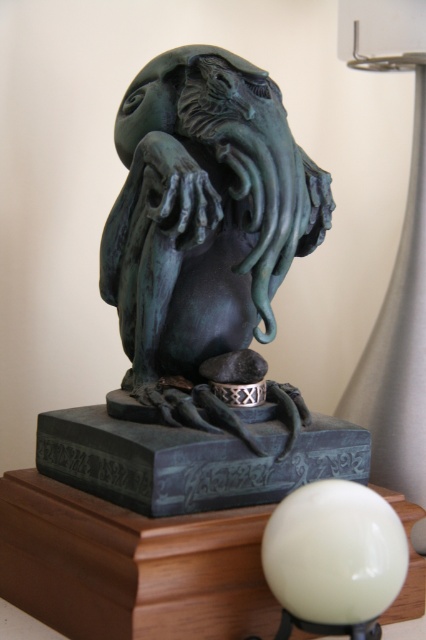
Which is more to the right, wooden table at lower left or white glossy sphere at lower center?

white glossy sphere at lower center

The width and height of the screenshot is (426, 640). In order to click on wooden table at lower left in this screenshot , I will do `click(129, 564)`.

Between green patina sculpture at center and white glossy sphere at lower center, which one is positioned lower?

Result: Positioned lower is white glossy sphere at lower center.

Can you confirm if green patina sculpture at center is thinner than white glossy sphere at lower center?

In fact, green patina sculpture at center might be wider than white glossy sphere at lower center.

Does point (143, 292) lie in front of point (331, 522)?

No.

What are the coordinates of `green patina sculpture at center` in the screenshot? It's located at pyautogui.click(x=204, y=212).

Can you confirm if green patina sculpture at center is positioned to the left of wooden table at lower left?

In fact, green patina sculpture at center is to the right of wooden table at lower left.

Does green patina sculpture at center have a lesser width compared to wooden table at lower left?

Correct, green patina sculpture at center's width is less than wooden table at lower left's.

This screenshot has height=640, width=426. Find the location of `green patina sculpture at center`. green patina sculpture at center is located at coordinates (204, 212).